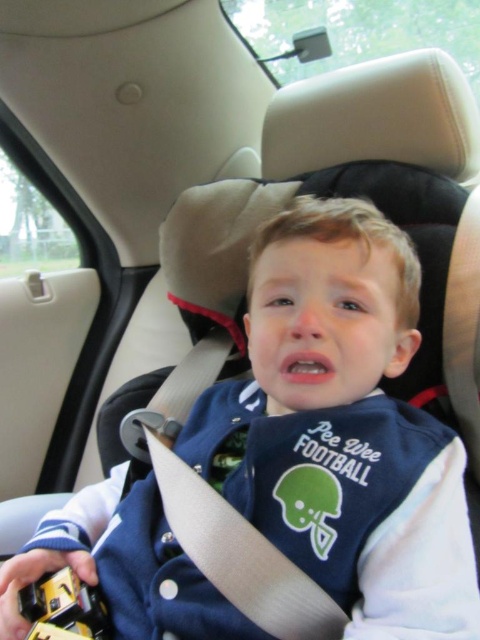
Question: Is blue fabric jacket at center above yellow plastic toy at lower left?

Choices:
 (A) no
 (B) yes

Answer: (B)

Question: Which of the following is the closest to the observer?

Choices:
 (A) (459, 458)
 (B) (29, 582)

Answer: (A)

Question: Among these objects, which one is farthest from the camera?

Choices:
 (A) blue fabric jacket at center
 (B) yellow plastic toy at lower left

Answer: (B)

Question: Which of the following is the farthest from the observer?

Choices:
 (A) (56, 598)
 (B) (363, 266)

Answer: (B)

Question: Does blue fabric jacket at center have a smaller size compared to yellow plastic toy at lower left?

Choices:
 (A) no
 (B) yes

Answer: (A)

Question: Is blue fabric jacket at center smaller than yellow plastic toy at lower left?

Choices:
 (A) yes
 (B) no

Answer: (B)